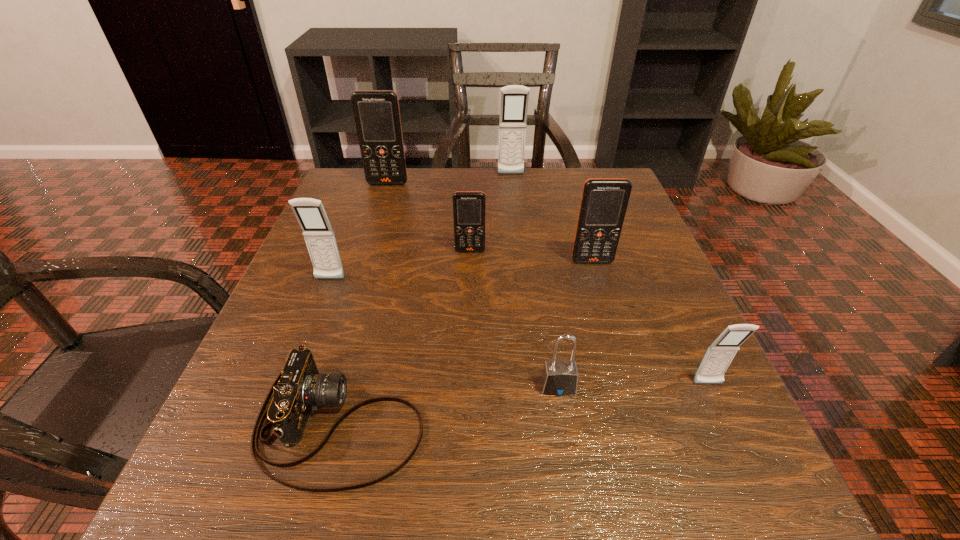
The height and width of the screenshot is (540, 960). I want to click on the smallest gray cellular telephone, so click(721, 352).

At what (x,y) coordinates should I click in order to perform the action: click on the nearest gray cellular telephone. Please return your answer as a coordinate pair (x, y). Looking at the image, I should click on (721, 352).

Identify the location of gray padlock. pos(559,377).

This screenshot has width=960, height=540. What are the coordinates of `the seventh tallest object` in the screenshot? It's located at (559, 377).

Identify the location of camera. (301, 388).

Where is `brown camera`? This screenshot has width=960, height=540. brown camera is located at coordinates (301, 388).

I want to click on vacant space situated on the front-facing side of the farthest object, so click(519, 255).

This screenshot has height=540, width=960. Identify the location of free space located on the screen of the biggest orange cellular telephone. 352,295.

What are the coordinates of `vacant space positioned 0.320m on the front-facing side of the leftmost gray cellular telephone` in the screenshot? It's located at [264, 448].

Identify the location of free space located on the screen of the second biggest orange cellular telephone. (653, 460).